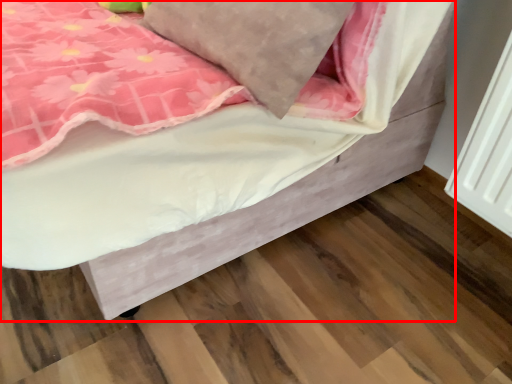
Question: From the image's perspective, what is the correct spatial relationship of bed (annotated by the red box) in relation to pillow?

Choices:
 (A) above
 (B) below

Answer: (A)